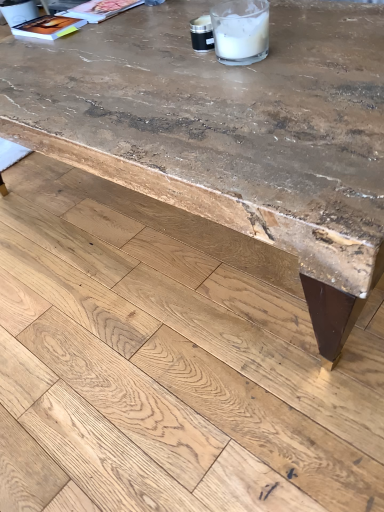
You are a GUI agent. You are given a task and a screenshot of the screen. Output one action in this format:
    pyautogui.click(x=<x>, y=<y>)
    Task: Click on the vacant region in front of matte paper magazine at upper left, which ranks as the second magazine in left-to-right order
    Image resolution: width=384 pixels, height=512 pixels.
    Given the screenshot: What is the action you would take?
    pyautogui.click(x=117, y=27)